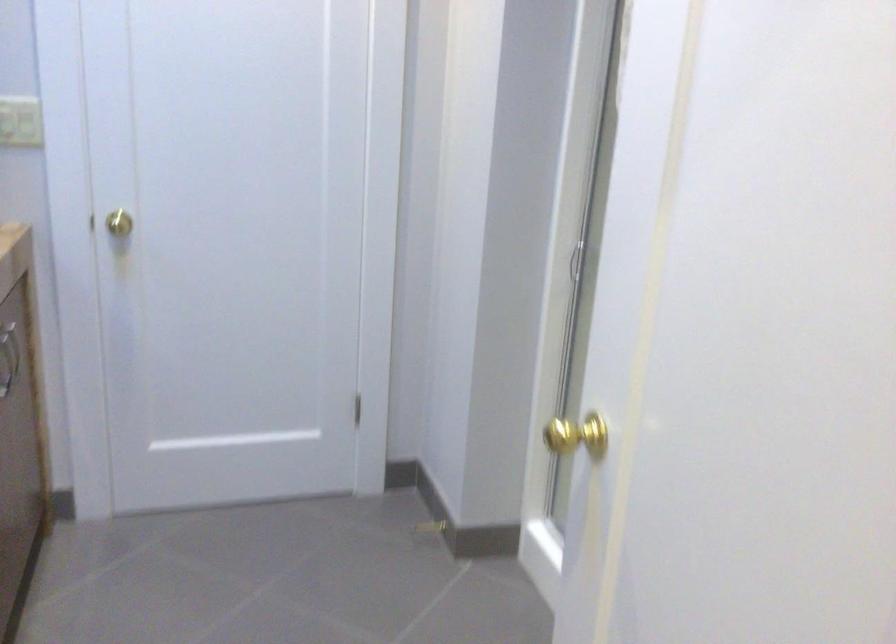
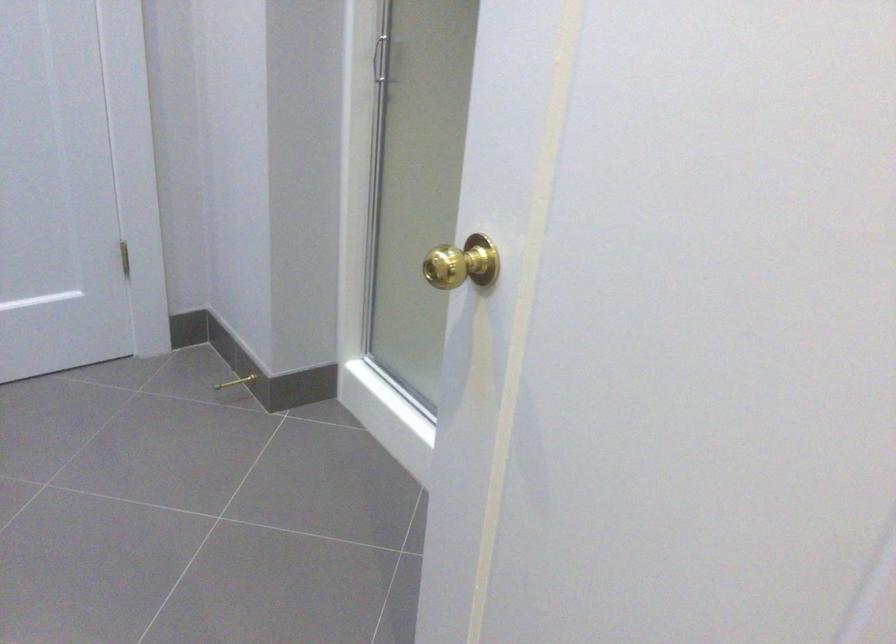
Where in the second image is the point corresponding to point 573,436 from the first image?

(461, 263)